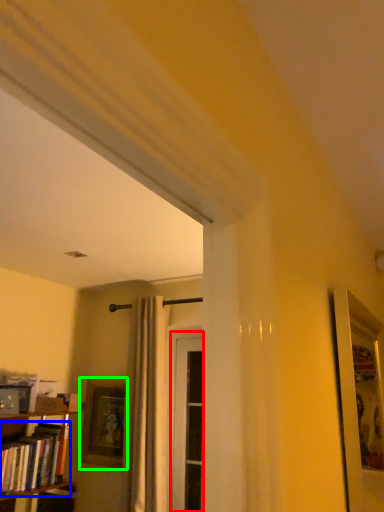
Question: Which object is positioned closest to screen door (highlighted by a red box)? Select from book (highlighted by a blue box) and picture frame (highlighted by a green box).

Choices:
 (A) book
 (B) picture frame

Answer: (B)